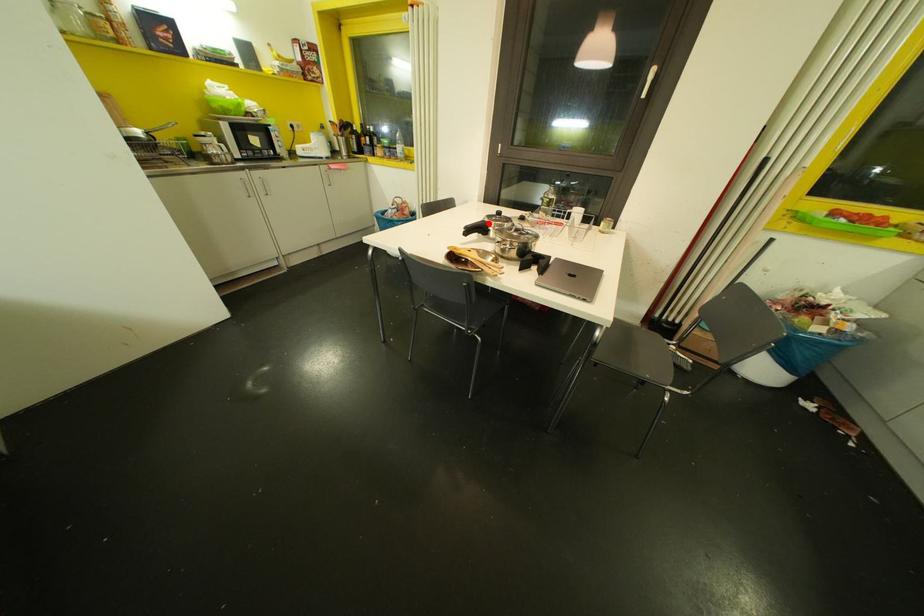
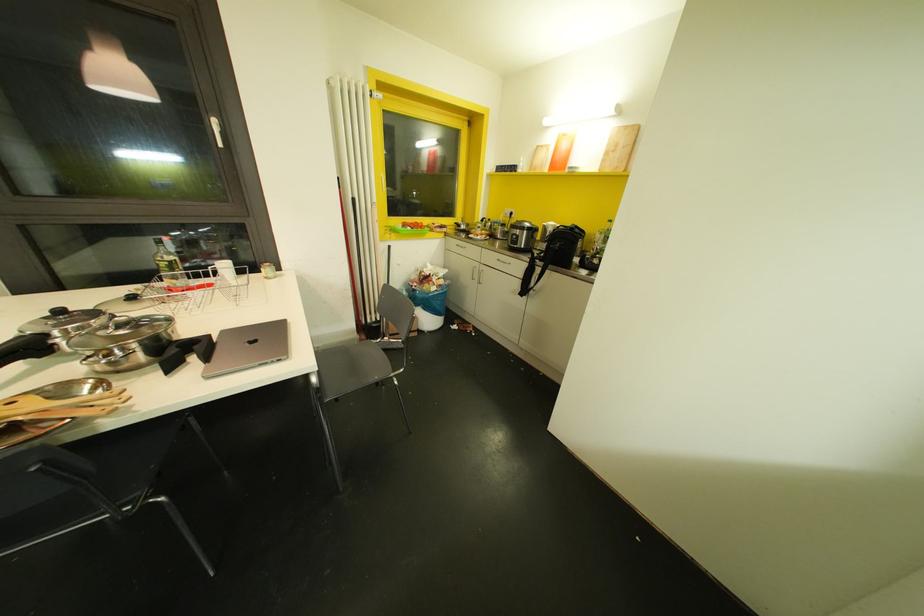
Find the pixel in the second image that matches the highlighted location in the first image.

(44, 334)